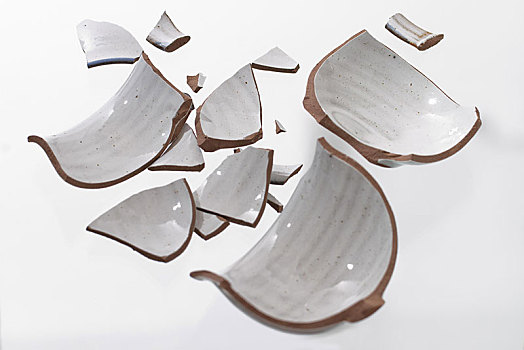
You are a GUI agent. You are given a task and a screenshot of the screen. Output one action in this format:
    pyautogui.click(x=<x>, y=<y>)
    Task: Click on the smallest piece of broken dish
    
    Given the screenshot: What is the action you would take?
    pyautogui.click(x=280, y=128)